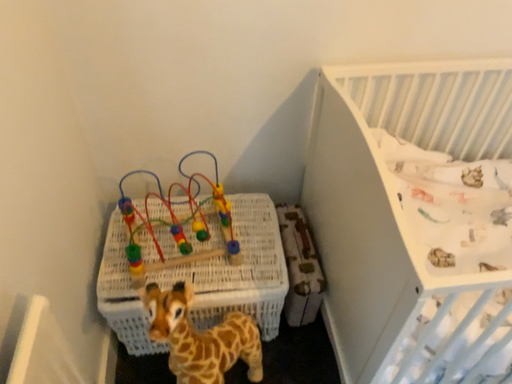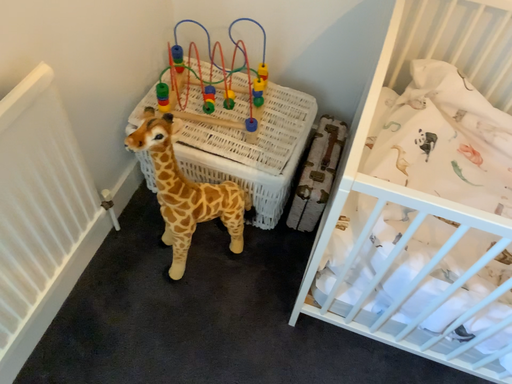
Question: Which way did the camera rotate in the video?

Choices:
 (A) rotated right
 (B) rotated left

Answer: (B)